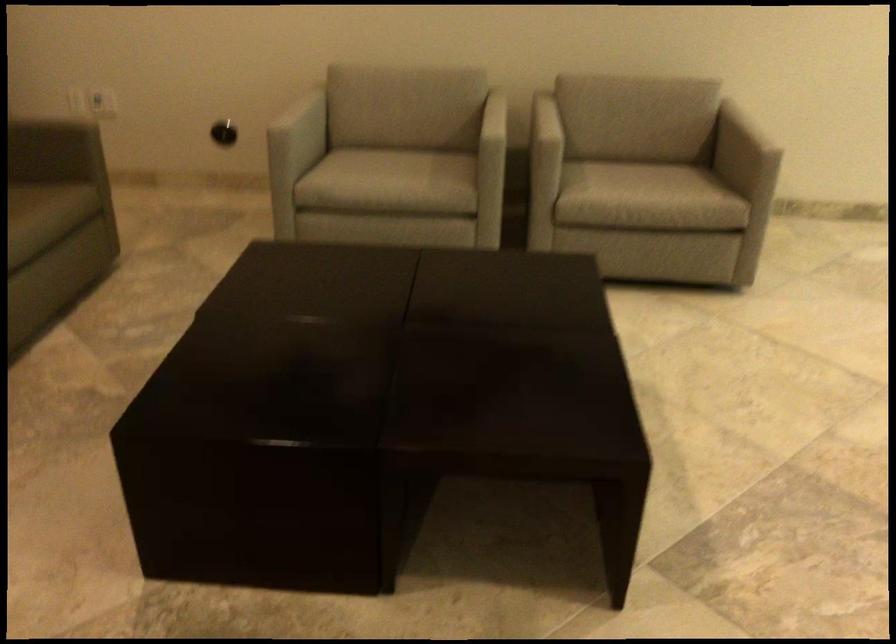
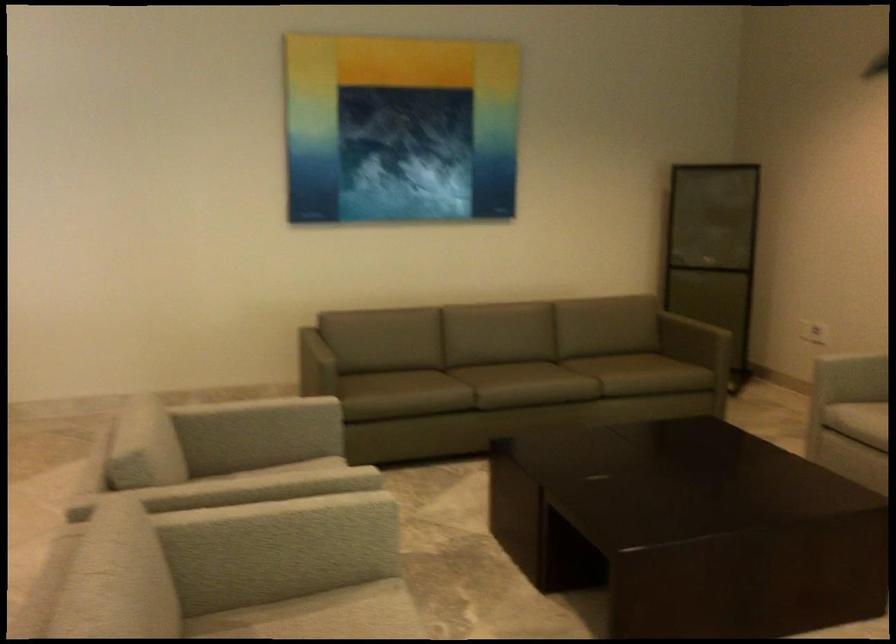
In the second image, find the point that corresponds to point (348, 178) in the first image.

(857, 420)